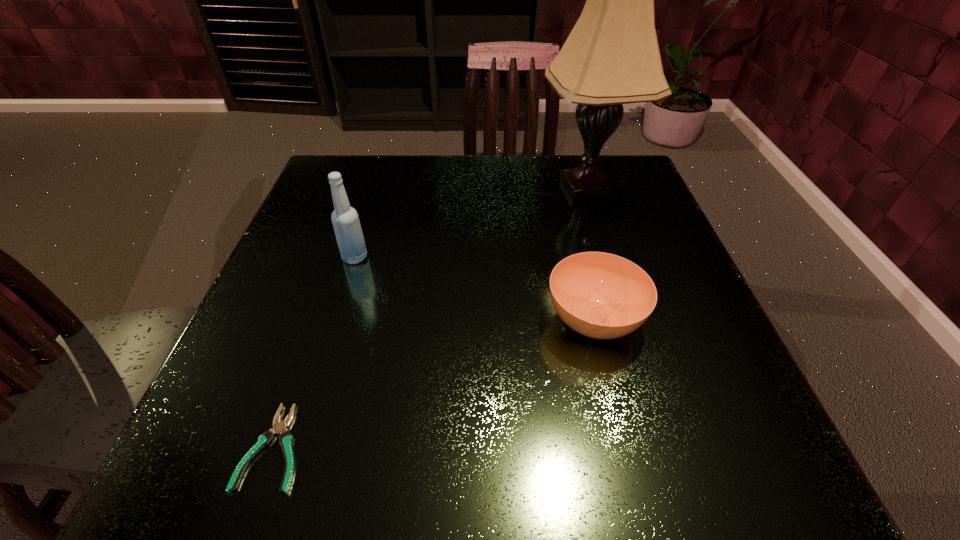
Identify the location of vacant area located 0.090m on the back of the second nearest object. The image size is (960, 540). (578, 253).

Identify the location of free region located 0.060m on the left of the pliers. Image resolution: width=960 pixels, height=540 pixels. (201, 447).

Find the location of a particular element. The height and width of the screenshot is (540, 960). object positioned at the far edge is located at coordinates (611, 57).

Identify the location of object at the near edge. The image size is (960, 540). (279, 427).

The width and height of the screenshot is (960, 540). What are the coordinates of `bottle that is at the left edge` in the screenshot? It's located at (345, 220).

Where is `pliers located at the left edge`? Image resolution: width=960 pixels, height=540 pixels. pliers located at the left edge is located at coordinates (279, 427).

Identify the location of lamp located at the right edge. (611, 57).

Locate an element on the screen. soup bowl that is at the right edge is located at coordinates (604, 296).

Where is `object present at the near left corner`? This screenshot has width=960, height=540. object present at the near left corner is located at coordinates (279, 427).

You are a GUI agent. You are given a task and a screenshot of the screen. Output one action in this format:
    pyautogui.click(x=<x>, y=<y>)
    Task: Click on the object at the far right corner
    This screenshot has height=540, width=960.
    Given the screenshot: What is the action you would take?
    pyautogui.click(x=611, y=57)